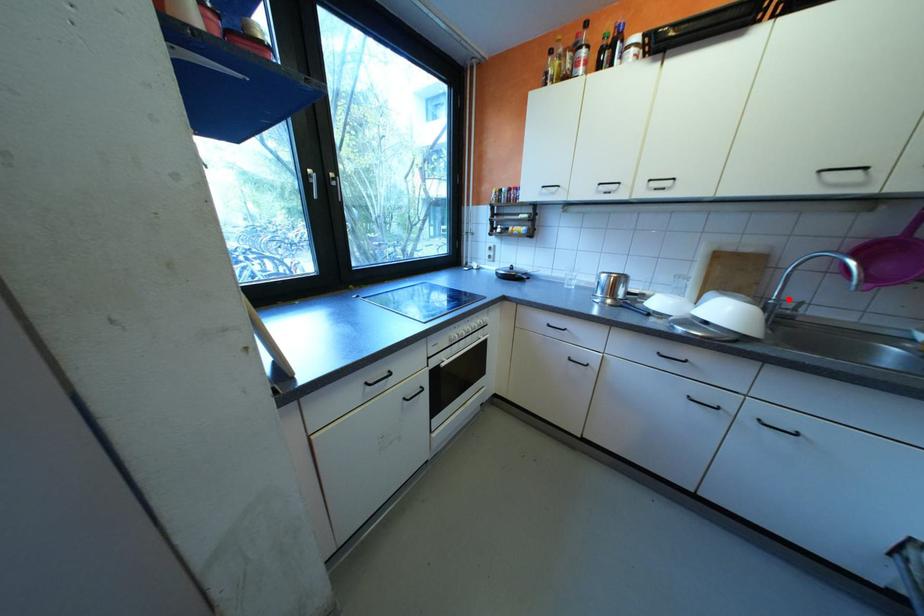
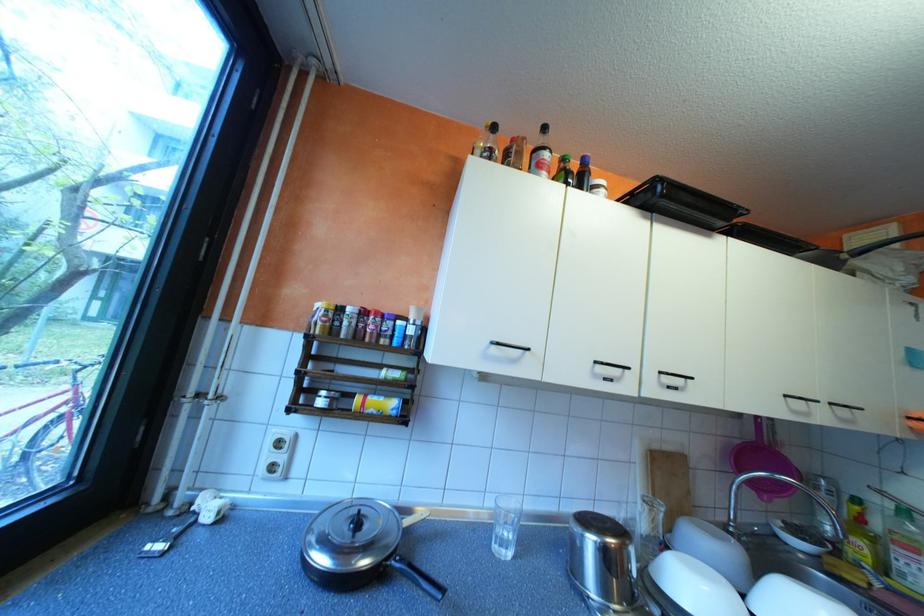
Find the pixel in the second image that matches the highlighted location in the first image.

(747, 525)